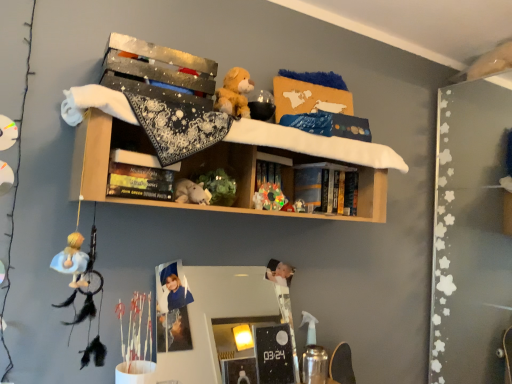
Question: Is white plush toy at center, the third toy in the right-to-left sequence, oriented towards blue hardcover book at center, acting as the second book starting from the front?

Choices:
 (A) yes
 (B) no

Answer: (B)

Question: Is white plush toy at center, the third toy in the right-to-left sequence, to the left of blue hardcover book at center, acting as the 2th book starting from the left, from the viewer's perspective?

Choices:
 (A) yes
 (B) no

Answer: (A)

Question: Is white plush toy at center, the third toy in the right-to-left sequence, not within blue hardcover book at center, acting as the second book starting from the front?

Choices:
 (A) yes
 (B) no

Answer: (A)

Question: Is white plush toy at center, the third toy in the right-to-left sequence, thinner than blue hardcover book at center, marked as the 1th book in a right-to-left arrangement?

Choices:
 (A) no
 (B) yes

Answer: (A)

Question: Considering the relative positions of white plush toy at center, the 1th toy when ordered from left to right, and blue hardcover book at center, which is counted as the 1th book, starting from the back, in the image provided, is white plush toy at center, the 1th toy when ordered from left to right, behind blue hardcover book at center, which is counted as the 1th book, starting from the back,?

Choices:
 (A) no
 (B) yes

Answer: (A)

Question: From a real-world perspective, is white plush toy at center, the third toy in the right-to-left sequence, physically located above or below shiny plastic toy at center, which ranks as the third toy in left-to-right order?

Choices:
 (A) above
 (B) below

Answer: (B)

Question: In the image, is white plush toy at center, the third toy in the right-to-left sequence, positioned in front of or behind shiny plastic toy at center, the 1th toy when ordered from right to left?

Choices:
 (A) behind
 (B) front

Answer: (B)

Question: In terms of size, does white plush toy at center, the third toy in the right-to-left sequence, appear bigger or smaller than shiny plastic toy at center, which ranks as the third toy in left-to-right order?

Choices:
 (A) small
 (B) big

Answer: (B)

Question: Considering the positions of white plush toy at center, the third toy in the right-to-left sequence, and shiny plastic toy at center, which ranks as the third toy in left-to-right order, in the image, is white plush toy at center, the third toy in the right-to-left sequence, wider or thinner than shiny plastic toy at center, which ranks as the third toy in left-to-right order,?

Choices:
 (A) thin
 (B) wide

Answer: (B)

Question: Considering the positions of point (136, 168) and point (207, 195), is point (136, 168) closer or farther from the camera than point (207, 195)?

Choices:
 (A) farther
 (B) closer

Answer: (B)

Question: In the image, is hardcover book at center, the 1th book viewed from the left, on the left side or the right side of white plush toy at center, the 1th toy when ordered from left to right?

Choices:
 (A) right
 (B) left

Answer: (B)

Question: Would you say hardcover book at center, the 2th book when ordered from back to front, is inside or outside white plush toy at center, the third toy in the right-to-left sequence?

Choices:
 (A) outside
 (B) inside

Answer: (A)

Question: From the image's perspective, is hardcover book at center, which is the 2th book in right-to-left order, positioned above or below white plush toy at center, the 1th toy when ordered from left to right?

Choices:
 (A) below
 (B) above

Answer: (B)

Question: Considering the relative positions of shiny plastic toy at center, the 1th toy when ordered from right to left, and blue hardcover book at center, acting as the 2th book starting from the left, in the image provided, is shiny plastic toy at center, the 1th toy when ordered from right to left, to the left or to the right of blue hardcover book at center, acting as the 2th book starting from the left,?

Choices:
 (A) right
 (B) left

Answer: (B)

Question: Would you say shiny plastic toy at center, which ranks as the third toy in left-to-right order, is inside or outside blue hardcover book at center, acting as the 2th book starting from the left?

Choices:
 (A) inside
 (B) outside

Answer: (B)